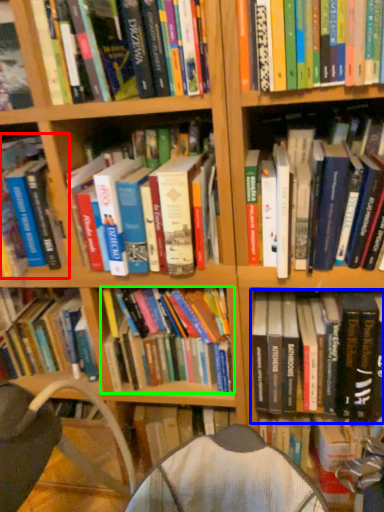
Question: Estimate the real-world distances between objects in this image. Which object is farther from book (highlighted by a red box), book (highlighted by a blue box) or book (highlighted by a green box)?

Choices:
 (A) book
 (B) book

Answer: (A)